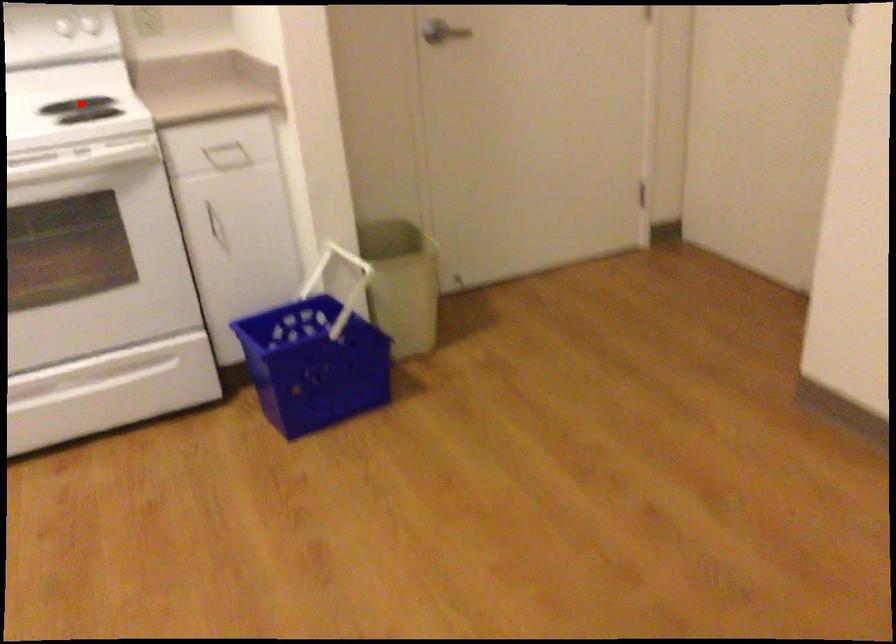
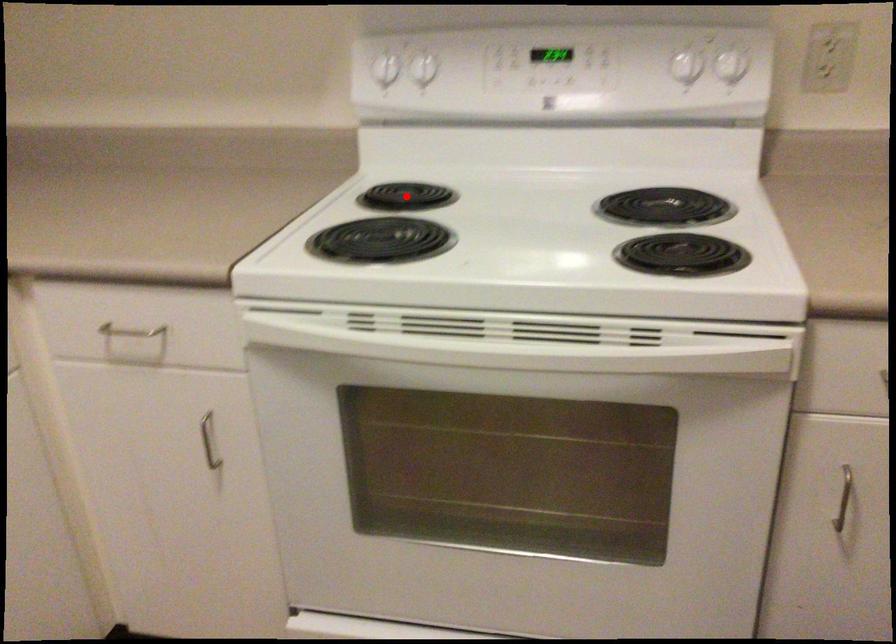
I am providing you with two images of the same scene from different viewpoints. A red point is marked on the first image and another point is marked on the second image. Is the marked point in image1 the same physical position as the marked point in image2?

No